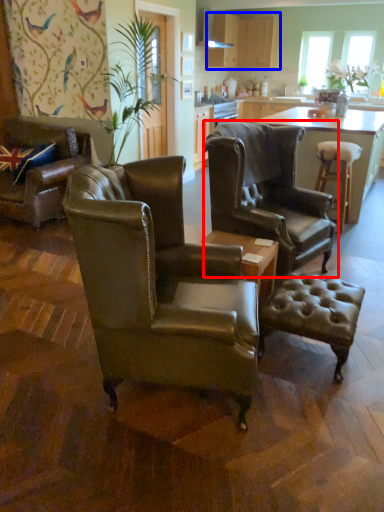
Question: Which of the following is the closest to the observer, chair (highlighted by a red box) or cabinetry (highlighted by a blue box)?

Choices:
 (A) chair
 (B) cabinetry

Answer: (A)